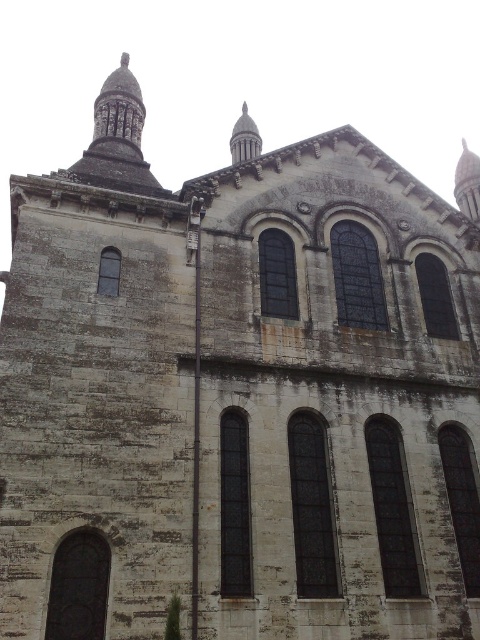
Between smooth gray spire at upper right and smooth gray stone spire at upper center, which one appears on the left side from the viewer's perspective?

smooth gray stone spire at upper center

Which is below, smooth gray spire at upper right or smooth gray stone spire at upper center?

smooth gray spire at upper right is below.

Is point (471, 164) farther from camera compared to point (231, 157)?

No, it is not.

Identify the location of smooth gray spire at upper right. (468, 182).